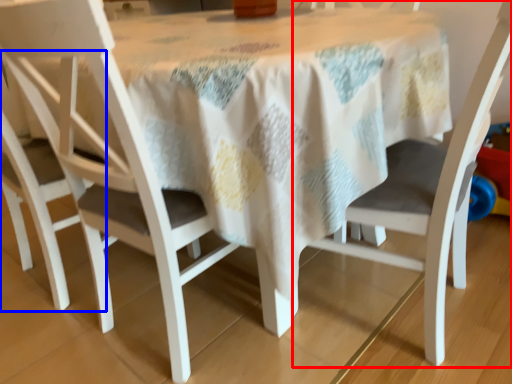
Question: Among these objects, which one is farthest to the camera, chair (highlighted by a red box) or chair (highlighted by a blue box)?

Choices:
 (A) chair
 (B) chair

Answer: (B)